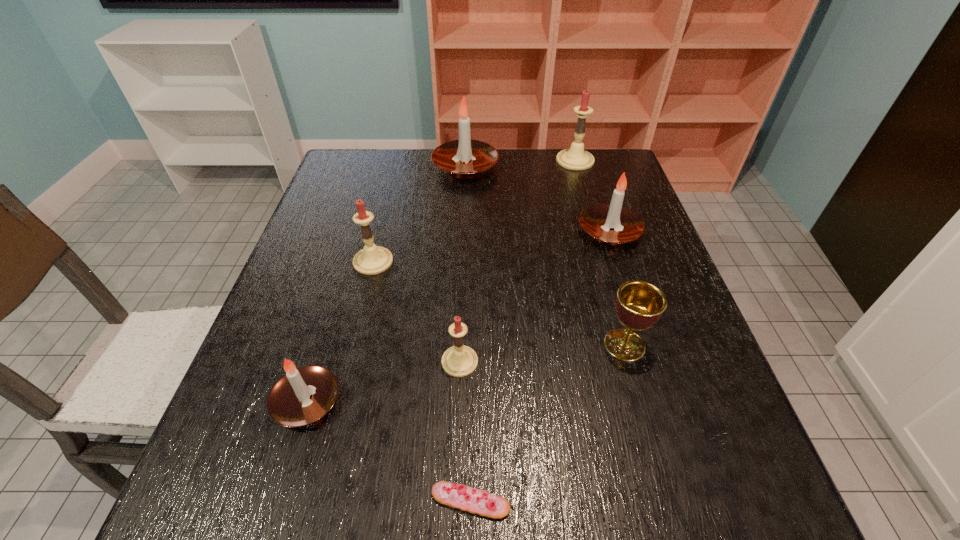
The image size is (960, 540). I want to click on vacant region between the leftmost red candle and the second red candle from right to left, so tap(417, 312).

Find the location of `free space between the second smallest white candle and the farthest white candle`. free space between the second smallest white candle and the farthest white candle is located at coordinates (538, 199).

Where is `object that stands as the sixth closest to the smallest red candle`? This screenshot has height=540, width=960. object that stands as the sixth closest to the smallest red candle is located at coordinates (465, 158).

Where is `object that is the nearest to the leftmost white candle`? object that is the nearest to the leftmost white candle is located at coordinates (459, 360).

Where is `the fourth closest candle to the second white candle from right to left`? the fourth closest candle to the second white candle from right to left is located at coordinates (459, 360).

Where is `candle that is the second nearest to the golden chalice`? The image size is (960, 540). candle that is the second nearest to the golden chalice is located at coordinates (459, 360).

Locate an element on the screen. the third closest white candle to the shortest object is located at coordinates (465, 158).

Point out which white candle is positioned as the second nearest to the eclair. Please provide its 2D coordinates. Your answer should be formatted as a tuple, i.e. [(x, y)], where the tuple contains the x and y coordinates of a point satisfying the conditions above.

[(596, 220)]

Locate which red candle is the closest to the second farthest red candle. Please provide its 2D coordinates. Your answer should be formatted as a tuple, i.e. [(x, y)], where the tuple contains the x and y coordinates of a point satisfying the conditions above.

[(459, 360)]

Locate which red candle is the second closest to the farthest red candle. Please provide its 2D coordinates. Your answer should be formatted as a tuple, i.e. [(x, y)], where the tuple contains the x and y coordinates of a point satisfying the conditions above.

[(459, 360)]